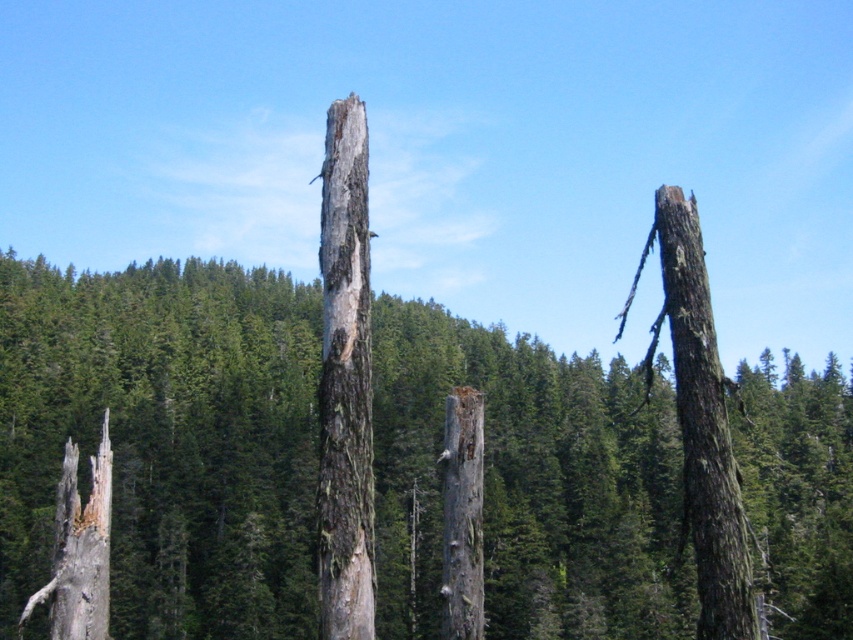
Question: Considering the real-world distances, which object is closest to the dark brown rough bark tree trunk at right?

Choices:
 (A) weathered bark tree trunk at center
 (B) gray rough bark tree trunk at center
 (C) green rough bark at center

Answer: (A)

Question: Which point is closer to the camera taking this photo?

Choices:
 (A) (538, 490)
 (B) (323, 166)

Answer: (B)

Question: Can you confirm if green rough bark at center is thinner than dark brown rough bark tree trunk at right?

Choices:
 (A) yes
 (B) no

Answer: (B)

Question: Which point is farther to the camera?

Choices:
 (A) (465, 467)
 (B) (683, 209)
 (C) (175, 408)

Answer: (C)

Question: Is green rough bark at center above dark brown rough bark tree trunk at right?

Choices:
 (A) yes
 (B) no

Answer: (A)

Question: Can you confirm if green rough bark at center is smaller than weathered bark tree trunk at center?

Choices:
 (A) yes
 (B) no

Answer: (B)